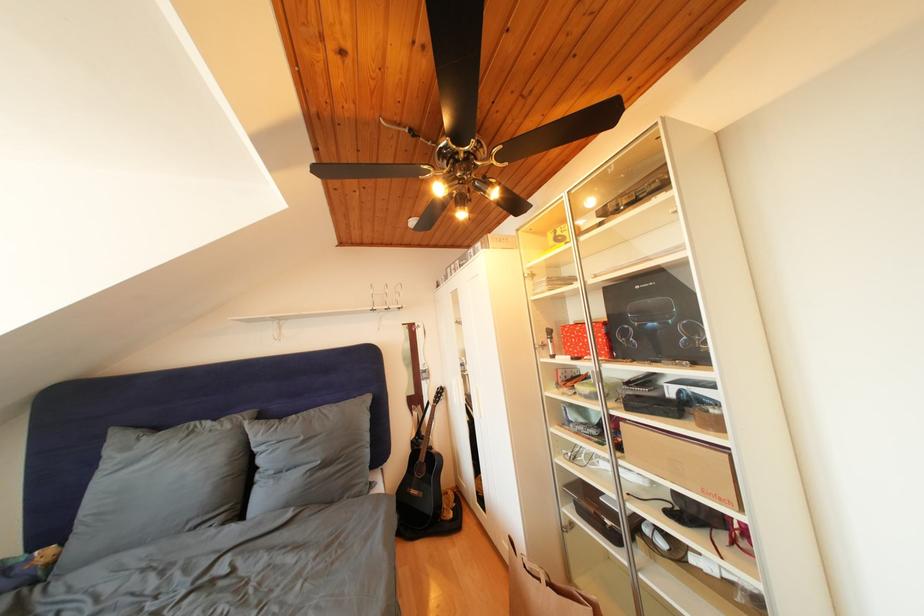
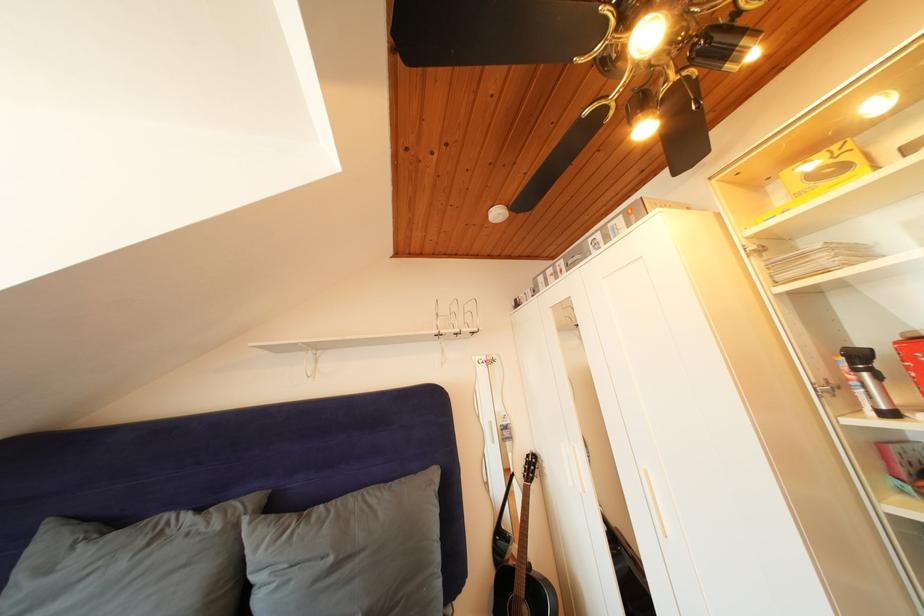
Locate, in the second image, the point that corresponds to (310,444) in the first image.

(338, 565)